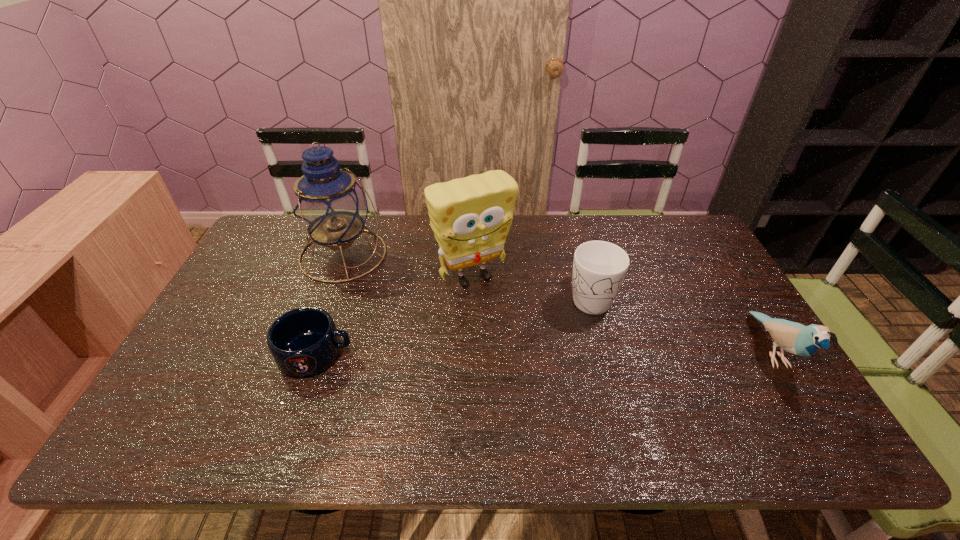
The image size is (960, 540). In order to click on free space on the desktop that is between the nearer mug and the bird and is positioned on the front-facing side of the lantern in this screenshot , I will do `click(491, 353)`.

I want to click on free spot on the desktop that is between the shortest object and the rightmost object and is positioned on the face of the second tallest object, so click(x=525, y=352).

You are a GUI agent. You are given a task and a screenshot of the screen. Output one action in this format:
    pyautogui.click(x=<x>, y=<y>)
    Task: Click on the free spot on the desktop that is between the shortest object and the bird and is positioned on the side of the taller mug with the handle
    The width and height of the screenshot is (960, 540).
    Given the screenshot: What is the action you would take?
    pyautogui.click(x=612, y=352)